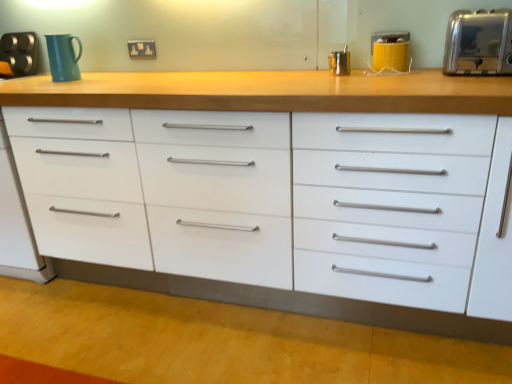
The width and height of the screenshot is (512, 384). Find the location of `vacant area located to the right-hand side of matte teal mug at upper left`. vacant area located to the right-hand side of matte teal mug at upper left is located at coordinates (104, 71).